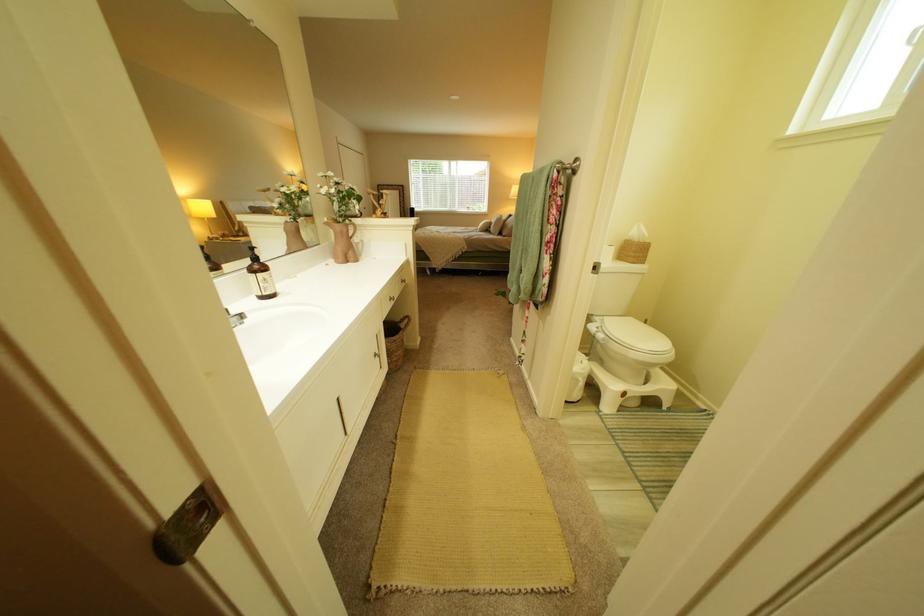
This screenshot has height=616, width=924. In order to click on wicker basket in this screenshot , I will do `click(395, 342)`.